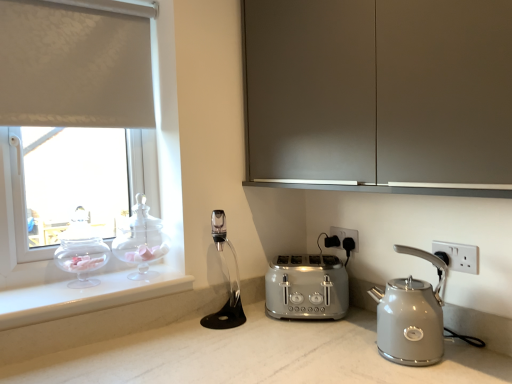
Question: Based on their sizes in the image, would you say transparent glass teapot at left, which is counted as the 1th tea pot, starting from the left, is bigger or smaller than white plastic electric outlet at right, which ranks as the 2th electric outlet in left-to-right order?

Choices:
 (A) small
 (B) big

Answer: (B)

Question: Would you say transparent glass teapot at left, which is counted as the 1th tea pot, starting from the left, is to the left or to the right of white plastic electric outlet at right, which is the first electric outlet in right-to-left order, in the picture?

Choices:
 (A) right
 (B) left

Answer: (B)

Question: Which object is positioned closest to the black plastic electric outlet at lower center, the first electric outlet in the back-to-front sequence?

Choices:
 (A) white plastic electric outlet at right, which ranks as the 2th electric outlet in left-to-right order
 (B) transparent glass teapot at left, which is counted as the 1th tea pot, starting from the left
 (C) satin silver toaster at center
 (D) matte gray cabinet at upper center
 (E) matte gray kettle at right

Answer: (C)

Question: Which object is the closest to the transparent glass teapot at left, which is the 2th tea pot in right-to-left order?

Choices:
 (A) clear glass jar at window, which is the first tea pot from right to left
 (B) satin silver toaster at center
 (C) matte gray cabinet at upper center
 (D) black plastic electric outlet at lower center, placed as the second electric outlet when sorted from front to back
 (E) white plastic electric outlet at right, which ranks as the 2th electric outlet in left-to-right order

Answer: (A)